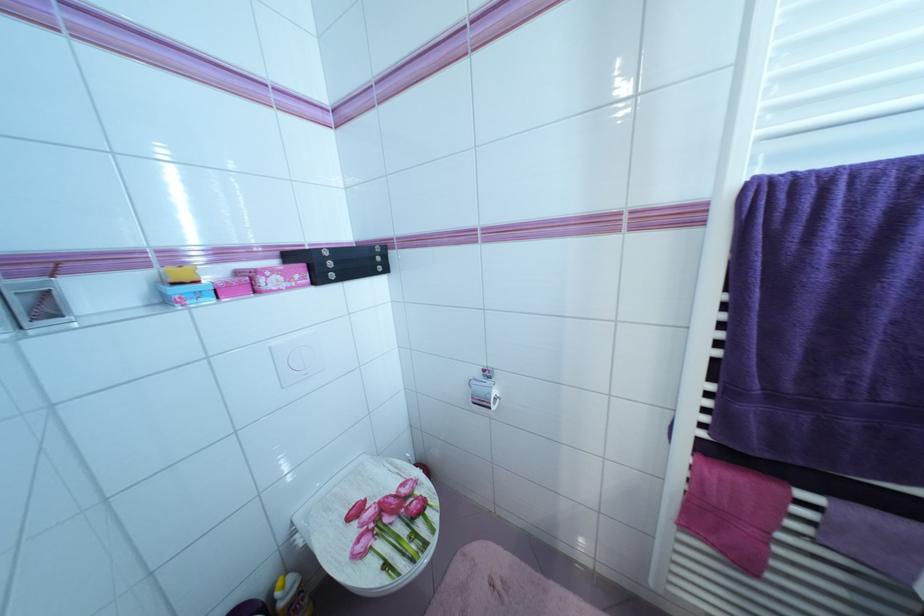
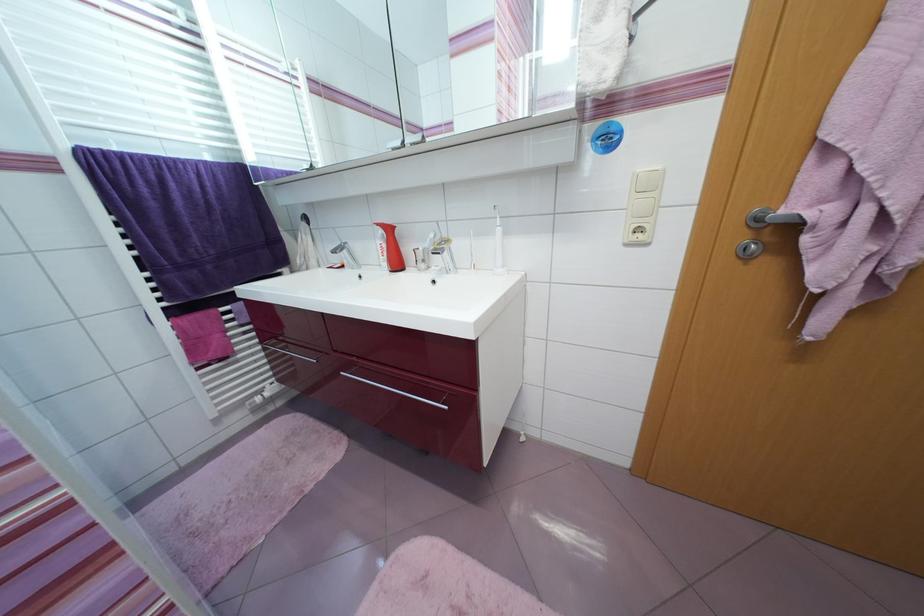
In the scene shown: Based on the continuous images, in which direction is the camera rotating?

The camera rotated toward right-down.